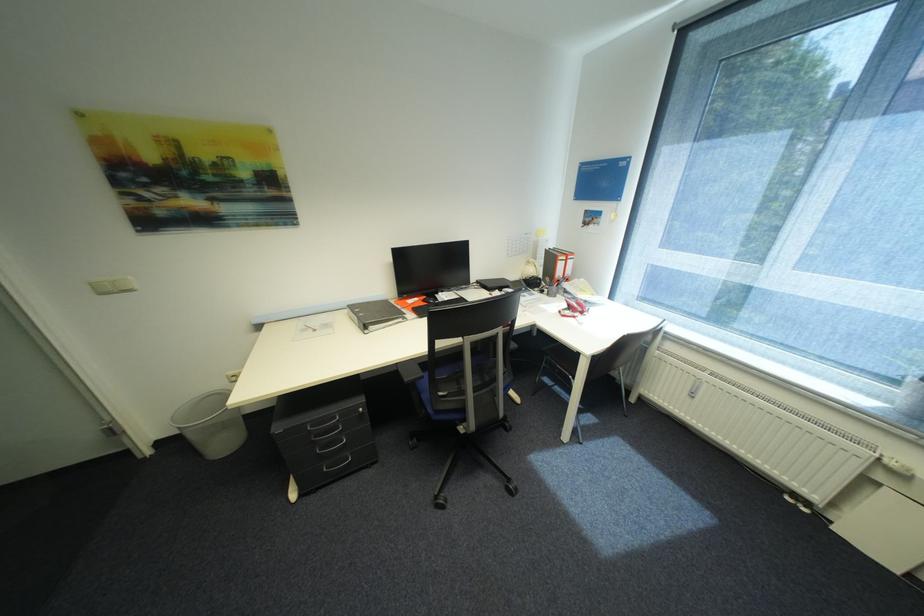
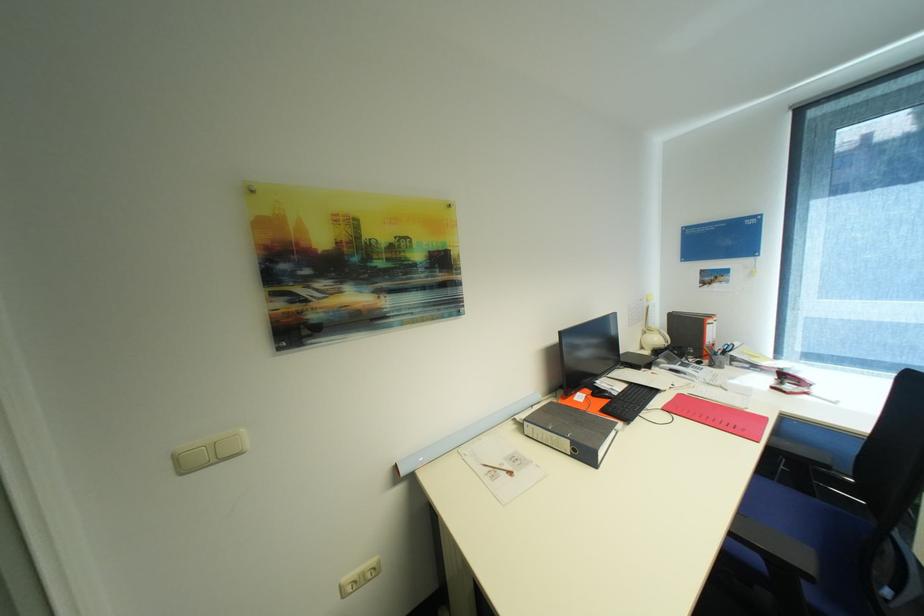
The point at (x=454, y=301) is marked in the first image. Where is the corresponding point in the second image?

(627, 391)